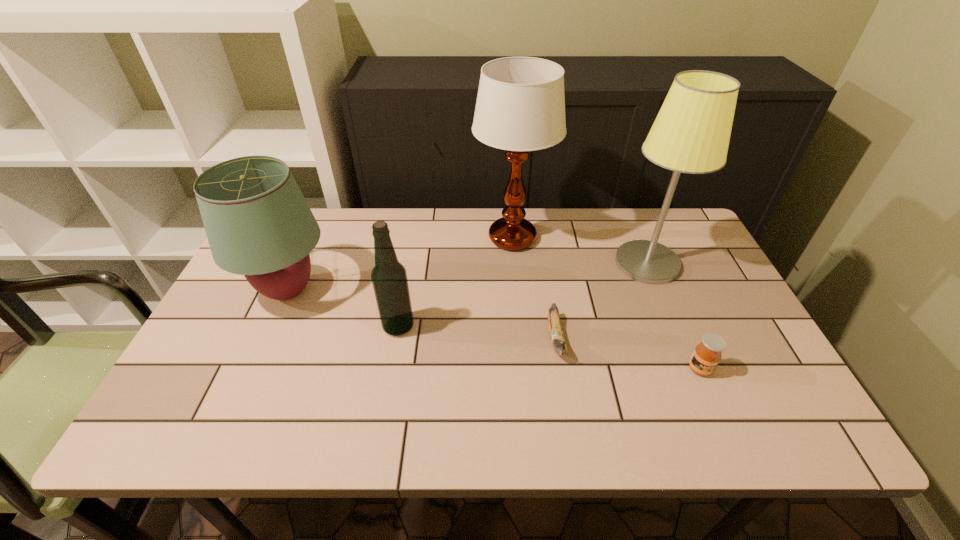
This screenshot has height=540, width=960. Identify the location of the third closest object to the leftmost object. (557, 338).

Identify which object is the third nearest to the banana. Please provide its 2D coordinates. Your answer should be formatted as a tuple, i.e. [(x, y)], where the tuple contains the x and y coordinates of a point satisfying the conditions above.

[(707, 354)]

Where is `vacant space that satisfies the following two spatial constraints: 1. on the front side of the lampshade; 2. on the right side of the alcohol`? This screenshot has width=960, height=540. vacant space that satisfies the following two spatial constraints: 1. on the front side of the lampshade; 2. on the right side of the alcohol is located at coordinates (272, 327).